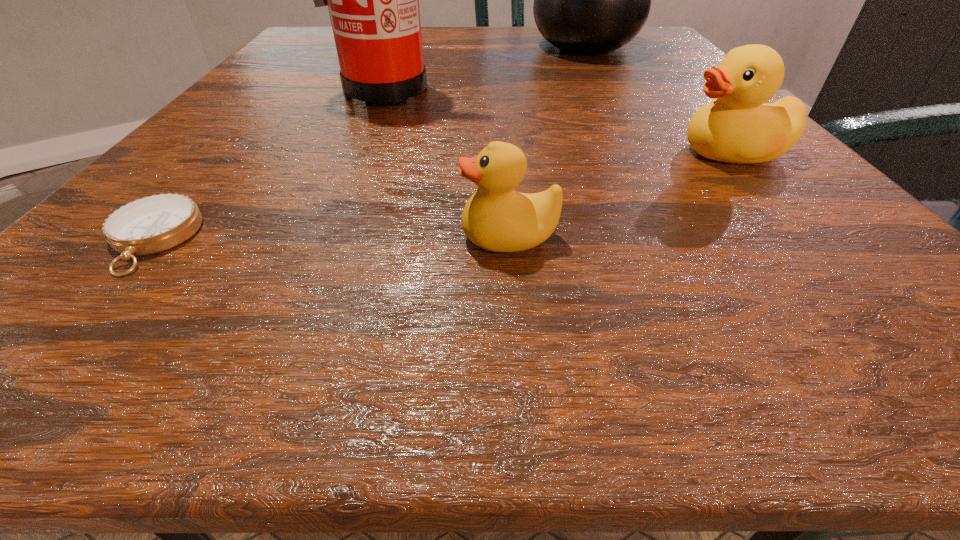
The image size is (960, 540). What are the coordinates of `object that can be found as the second closest to the farther duck` in the screenshot? It's located at (590, 0).

At what (x,y) coordinates should I click in order to perform the action: click on object that is the closest one to the third shortest object. Please return your answer as a coordinate pair (x, y). Image resolution: width=960 pixels, height=540 pixels. Looking at the image, I should click on (497, 218).

The image size is (960, 540). Find the location of `free spot that satisfies the following two spatial constraints: 1. at the beak of the third farthest object; 2. on the front side of the compass`. free spot that satisfies the following two spatial constraints: 1. at the beak of the third farthest object; 2. on the front side of the compass is located at coordinates (806, 239).